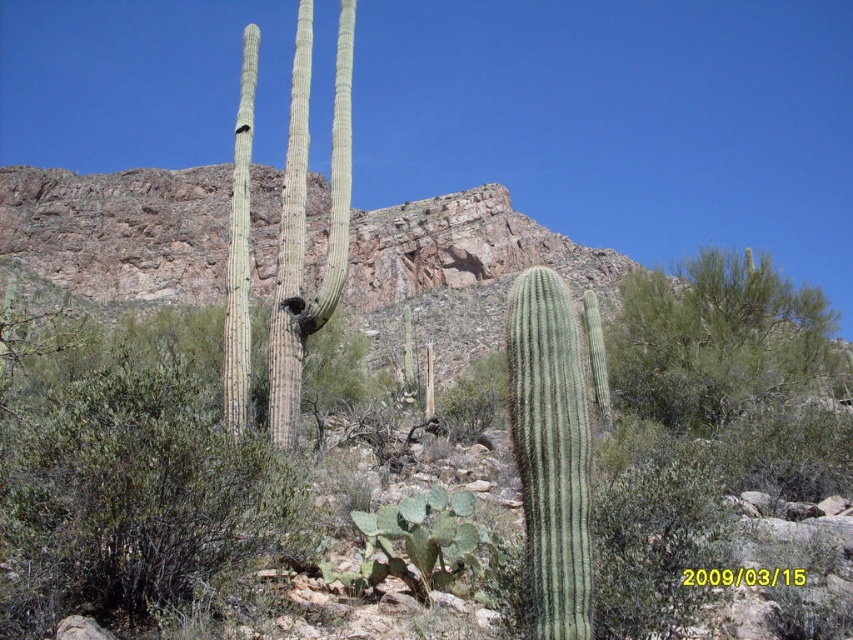
Does green ribbed cactus at center have a larger size compared to green spiny cactus at lower center?

Actually, green ribbed cactus at center might be smaller than green spiny cactus at lower center.

Does green ribbed cactus at center appear on the right side of green spiny cactus at lower center?

Indeed, green ribbed cactus at center is positioned on the right side of green spiny cactus at lower center.

Which is behind, point (538, 419) or point (488, 563)?

Point (488, 563)

The height and width of the screenshot is (640, 853). I want to click on green ribbed cactus at center, so click(x=550, y=451).